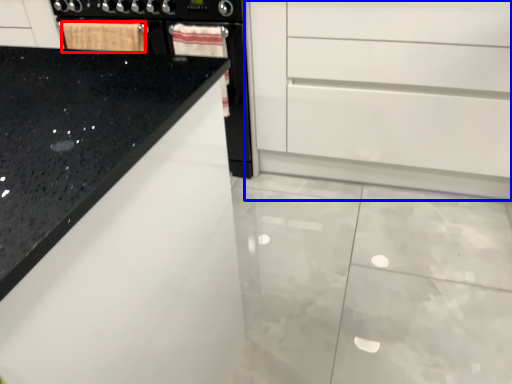
Question: Which object is closer to the camera taking this photo, material (highlighted by a red box) or chest of drawers (highlighted by a blue box)?

Choices:
 (A) material
 (B) chest of drawers

Answer: (B)